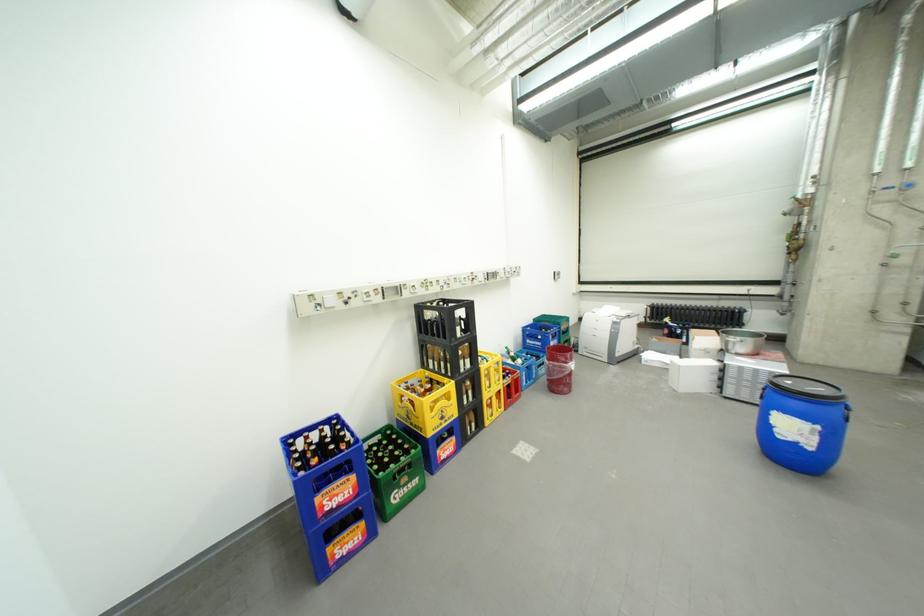
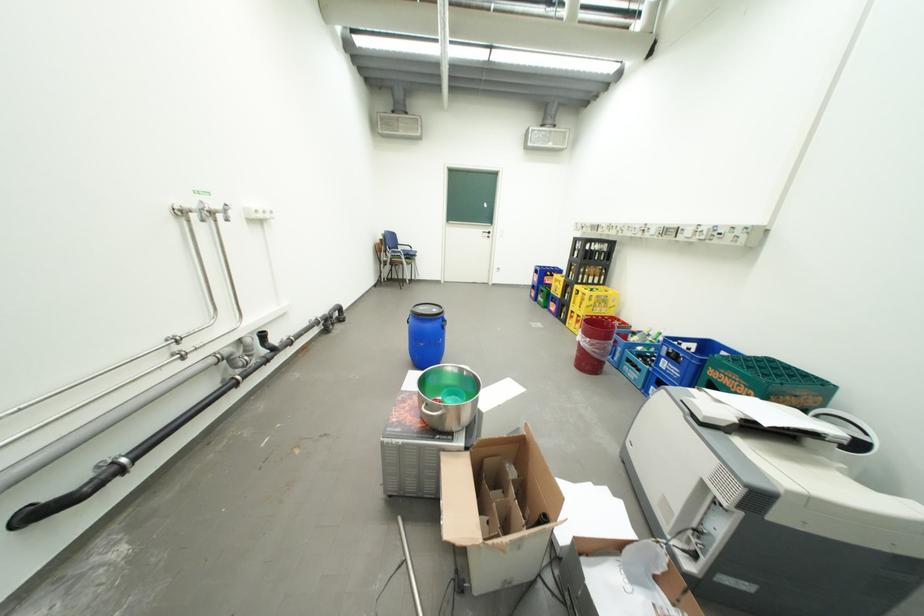
The point at (562, 344) is marked in the first image. Where is the corresponding point in the second image?

(674, 361)